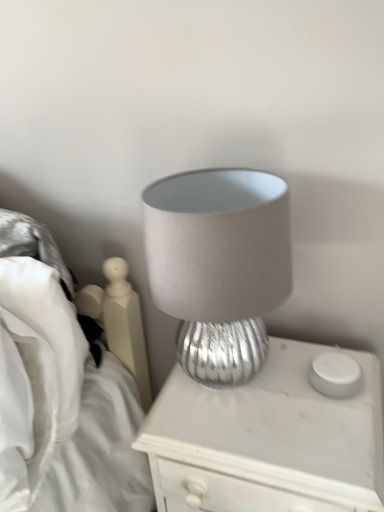
Question: Does silver textured lamp at center touch white matte candle holder at right?

Choices:
 (A) yes
 (B) no

Answer: (B)

Question: Is the position of silver textured lamp at center more distant than that of white matte candle holder at right?

Choices:
 (A) no
 (B) yes

Answer: (A)

Question: Is silver textured lamp at center closer to camera compared to white matte candle holder at right?

Choices:
 (A) yes
 (B) no

Answer: (A)

Question: Can you confirm if silver textured lamp at center is wider than white matte candle holder at right?

Choices:
 (A) no
 (B) yes

Answer: (B)

Question: Would you say silver textured lamp at center is a long distance from white matte candle holder at right?

Choices:
 (A) yes
 (B) no

Answer: (B)

Question: Is silver textured lamp at center taller than white matte candle holder at right?

Choices:
 (A) no
 (B) yes

Answer: (B)

Question: Considering the relative sizes of satin gray lampshade at center and white matte candle holder at right in the image provided, is satin gray lampshade at center thinner than white matte candle holder at right?

Choices:
 (A) yes
 (B) no

Answer: (B)

Question: Does satin gray lampshade at center lie in front of white matte candle holder at right?

Choices:
 (A) no
 (B) yes

Answer: (B)

Question: Is satin gray lampshade at center taller than white matte candle holder at right?

Choices:
 (A) yes
 (B) no

Answer: (A)

Question: Does satin gray lampshade at center have a lesser height compared to white matte candle holder at right?

Choices:
 (A) no
 (B) yes

Answer: (A)

Question: Is satin gray lampshade at center positioned beyond the bounds of white matte candle holder at right?

Choices:
 (A) no
 (B) yes

Answer: (B)

Question: Is satin gray lampshade at center facing away from white matte candle holder at right?

Choices:
 (A) yes
 (B) no

Answer: (B)

Question: Does white matte candle holder at right have a lesser height compared to silver textured lamp at center?

Choices:
 (A) no
 (B) yes

Answer: (B)